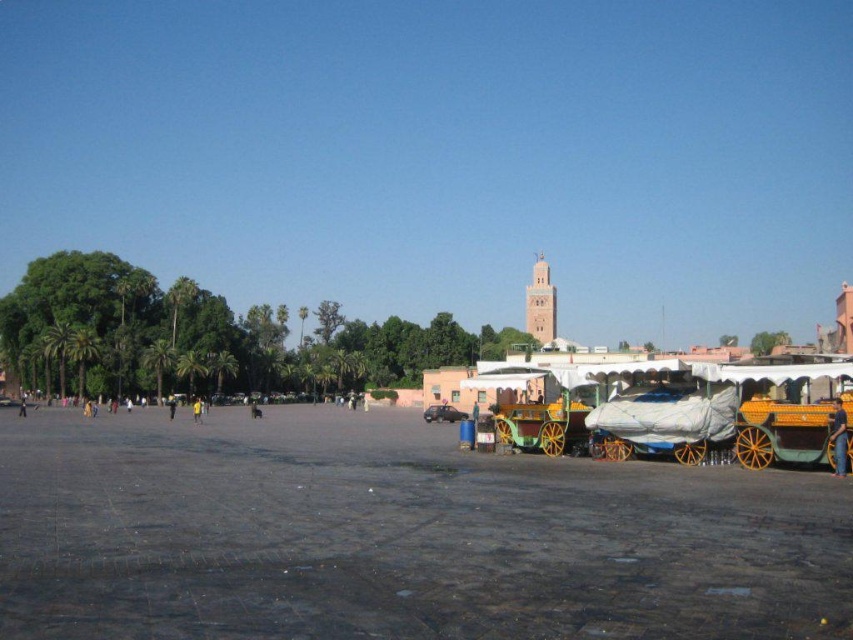
Is smooth stone pavement at center above yellow fabric person at center?

Correct, smooth stone pavement at center is located above yellow fabric person at center.

Can you confirm if smooth stone pavement at center is positioned to the right of yellow fabric person at center?

Correct, you'll find smooth stone pavement at center to the right of yellow fabric person at center.

Does point (190, 577) lie in front of point (198, 403)?

Yes, point (190, 577) is closer to viewer.

I want to click on smooth stone pavement at center, so click(396, 536).

Who is positioned more to the right, orange wood horse cart at lower right or yellow fabric person at center?

orange wood horse cart at lower right

You are a GUI agent. You are given a task and a screenshot of the screen. Output one action in this format:
    pyautogui.click(x=<x>, y=<y>)
    Task: Click on the orange wood horse cart at lower right
    
    Given the screenshot: What is the action you would take?
    pyautogui.click(x=782, y=433)

I want to click on orange wood horse cart at lower right, so click(x=782, y=433).

What are the coordinates of `orange wood horse cart at lower right` in the screenshot? It's located at (782, 433).

Which is above, smooth stone pavement at center or orange fabric cart at lower right?

orange fabric cart at lower right

Does point (654, 531) come in front of point (842, 410)?

That is True.

Does point (250, 592) lie in front of point (837, 396)?

Yes, point (250, 592) is in front of point (837, 396).

Find the location of a particular element. Image resolution: width=853 pixels, height=640 pixels. smooth stone pavement at center is located at coordinates (396, 536).